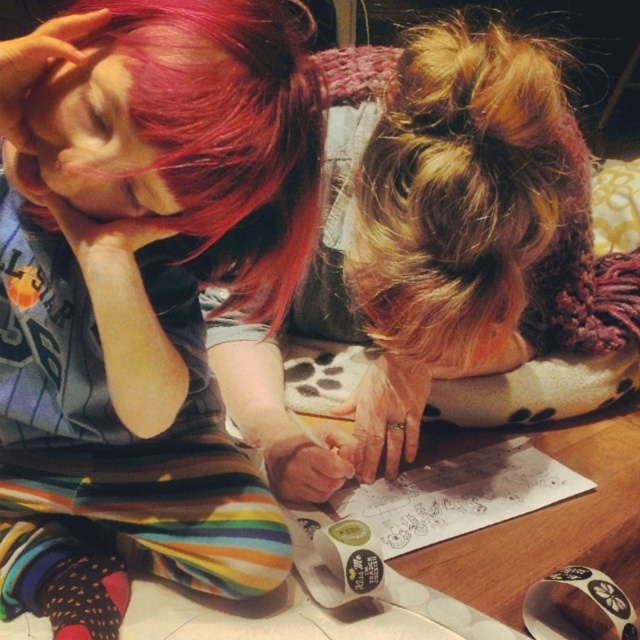
Can you confirm if matte black shirt at center is positioned below blonde hair bun at upper center?

Correct, matte black shirt at center is located below blonde hair bun at upper center.

Between point (60, 209) and point (392, 273), which one is positioned behind?

The point (392, 273) is more distant.

Image resolution: width=640 pixels, height=640 pixels. I want to click on matte black shirt at center, so click(x=141, y=292).

Identify the location of matte black shirt at center. This screenshot has width=640, height=640. (141, 292).